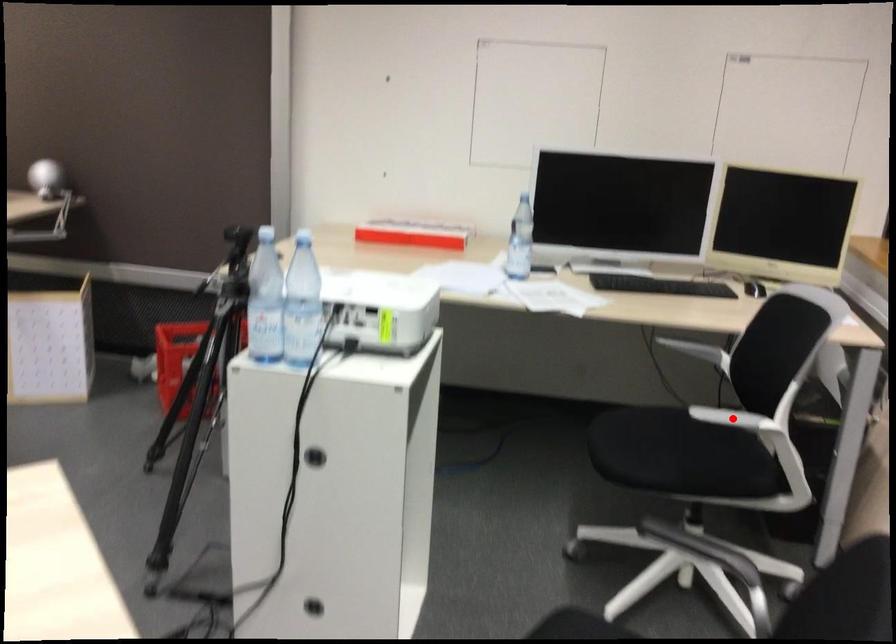
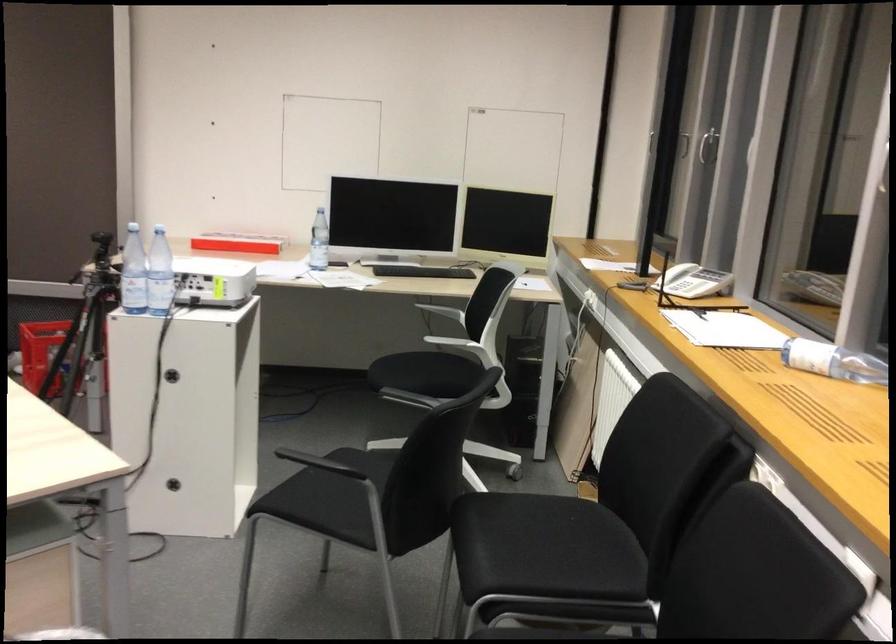
Question: I am providing you with two images of the same scene from different viewpoints. A red point is marked on the first image. Is the red point's position out of view in image 2?

Choices:
 (A) Yes
 (B) No

Answer: (A)